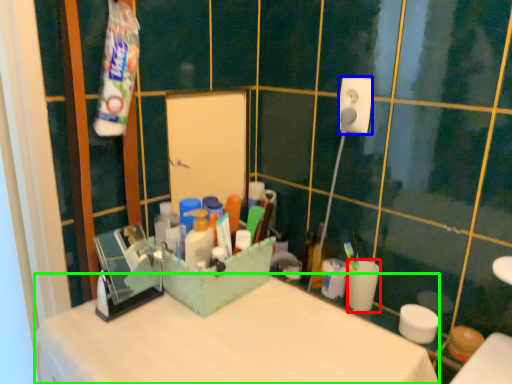
Question: Based on their relative distances, which object is farther from coffee cup (highlighted by a red box)? Choose from power plugs and sockets (highlighted by a blue box) and counter top (highlighted by a green box).

Choices:
 (A) power plugs and sockets
 (B) counter top

Answer: (A)